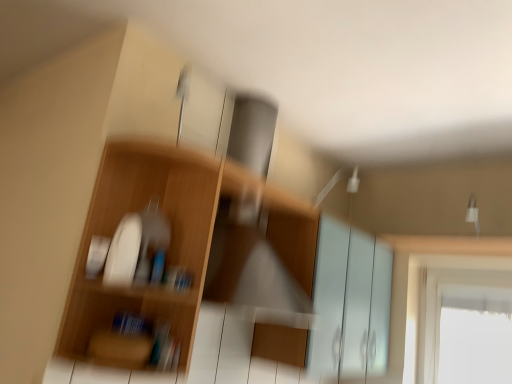
Identify the location of wooden shelf at left. (187, 253).

The width and height of the screenshot is (512, 384). Describe the element at coordinates (187, 253) in the screenshot. I see `wooden shelf at left` at that location.

What do you see at coordinates (350, 302) in the screenshot? The image size is (512, 384). I see `white glossy screen door at center` at bounding box center [350, 302].

Where is `white glossy screen door at center`? This screenshot has width=512, height=384. white glossy screen door at center is located at coordinates (350, 302).

You are a GUI agent. You are given a task and a screenshot of the screen. Output one action in this format:
    pyautogui.click(x=<x>, y=<y>)
    Task: Click on the wooden shelf at left
    
    Given the screenshot: What is the action you would take?
    pyautogui.click(x=187, y=253)

Considering the relative positions of wooden shelf at left and white glossy screen door at center in the image provided, is wooden shelf at left to the left or to the right of white glossy screen door at center?

Based on their positions, wooden shelf at left is located to the left of white glossy screen door at center.

Between wooden shelf at left and white glossy screen door at center, which one is positioned in front?

wooden shelf at left.

Is point (142, 187) positioned after point (367, 321)?

No, it is not.

From the image's perspective, is wooden shelf at left positioned above or below white glossy screen door at center?

wooden shelf at left is situated higher than white glossy screen door at center in the image.

Looking at this image, from a real-world perspective, is wooden shelf at left located higher than white glossy screen door at center?

Correct, in the physical world, wooden shelf at left is higher than white glossy screen door at center.

Considering the sizes of wooden shelf at left and white glossy screen door at center in the image, is wooden shelf at left wider or thinner than white glossy screen door at center?

In the image, wooden shelf at left appears to be more narrow than white glossy screen door at center.

Considering the sizes of wooden shelf at left and white glossy screen door at center in the image, is wooden shelf at left taller or shorter than white glossy screen door at center?

Clearly, wooden shelf at left is shorter compared to white glossy screen door at center.

Considering the sizes of objects wooden shelf at left and white glossy screen door at center in the image provided, who is smaller, wooden shelf at left or white glossy screen door at center?

wooden shelf at left.

Can white glossy screen door at center be found inside wooden shelf at left?

No, white glossy screen door at center is not a part of wooden shelf at left.

Is wooden shelf at left next to white glossy screen door at center?

wooden shelf at left and white glossy screen door at center are clearly separated.

Could you tell me if wooden shelf at left is facing white glossy screen door at center?

No, wooden shelf at left is not oriented towards white glossy screen door at center.

What's the angular difference between wooden shelf at left and white glossy screen door at center's facing directions?

0.729 degrees separate the facing orientations of wooden shelf at left and white glossy screen door at center.

Image resolution: width=512 pixels, height=384 pixels. I want to click on shelf above the white glossy screen door at center (from a real-world perspective), so click(x=187, y=253).

Does white glossy screen door at center appear on the right side of wooden shelf at left?

Indeed, white glossy screen door at center is positioned on the right side of wooden shelf at left.

From the picture: In the image, is white glossy screen door at center positioned in front of or behind wooden shelf at left?

white glossy screen door at center is behind wooden shelf at left.

From the picture: Which is closer to the camera, (x=351, y=368) or (x=296, y=261)?

Clearly, point (x=351, y=368) is more distant from the camera than point (x=296, y=261).

From the image's perspective, is white glossy screen door at center located beneath wooden shelf at left?

Yes, from the image's perspective, white glossy screen door at center is below wooden shelf at left.

From a real-world perspective, is white glossy screen door at center physically above wooden shelf at left?

Actually, white glossy screen door at center is physically below wooden shelf at left in the real world.

Between white glossy screen door at center and wooden shelf at left, which one has larger width?

Wider between the two is white glossy screen door at center.

Between white glossy screen door at center and wooden shelf at left, which one has less height?

wooden shelf at left.

Considering the sizes of objects white glossy screen door at center and wooden shelf at left in the image provided, who is smaller, white glossy screen door at center or wooden shelf at left?

With smaller size is wooden shelf at left.

Would you say white glossy screen door at center is inside or outside wooden shelf at left?

white glossy screen door at center cannot be found inside wooden shelf at left.

Is the surface of white glossy screen door at center in direct contact with wooden shelf at left?

No, white glossy screen door at center is not making contact with wooden shelf at left.

Could you tell me if white glossy screen door at center is facing wooden shelf at left?

No, white glossy screen door at center is not facing towards wooden shelf at left.

Locate an element on the screen. shelf on the left of white glossy screen door at center is located at coordinates (187, 253).

Where is `screen door that is behind the wooden shelf at left`? screen door that is behind the wooden shelf at left is located at coordinates (350, 302).

You are a GUI agent. You are given a task and a screenshot of the screen. Output one action in this format:
    pyautogui.click(x=<x>, y=<y>)
    Task: Click on the screen door directly beneath the wooden shelf at left (from a real-world perspective)
    The image size is (512, 384).
    Given the screenshot: What is the action you would take?
    pyautogui.click(x=350, y=302)